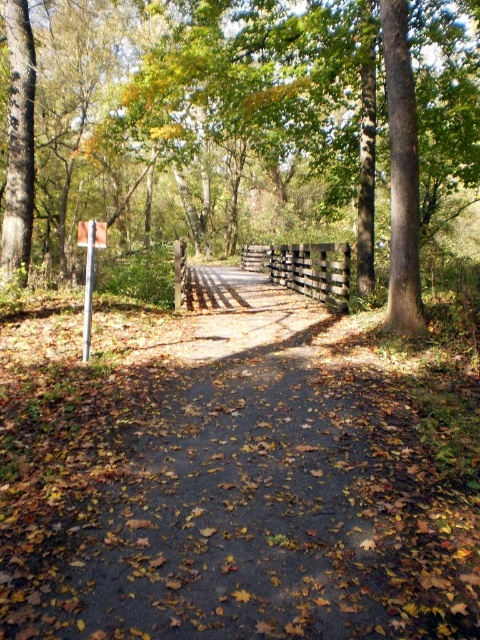
You are standing at the entrance of the forest path and want to reach the wooden bridge ahead. There is a brown wood fence at center blocking your direct path. Can you walk around it on either side? Please specify which side has more space based on their positions.

The brown wood fence at center is located at point (240, 128). Since the fence is at the center, you can walk around it on either side. However, without specific information about the space available on each side, I cannot determine which side has more space.

You are a hiker trying to decide which direction to take next. You see a brown wood fence at center and a brown wooden fence at center. Which one is larger in size?

The brown wood fence at center is bigger than the brown wooden fence at center.

You are a hiker walking along the paved path in the forest. You notice two brown fences at the center of the scene. Which one is closer to you, the brown wood fence at center or the brown wooden fence at center?

The brown wood fence at center is closer to you because it is positioned over the brown wooden fence at center, indicating it is in front.